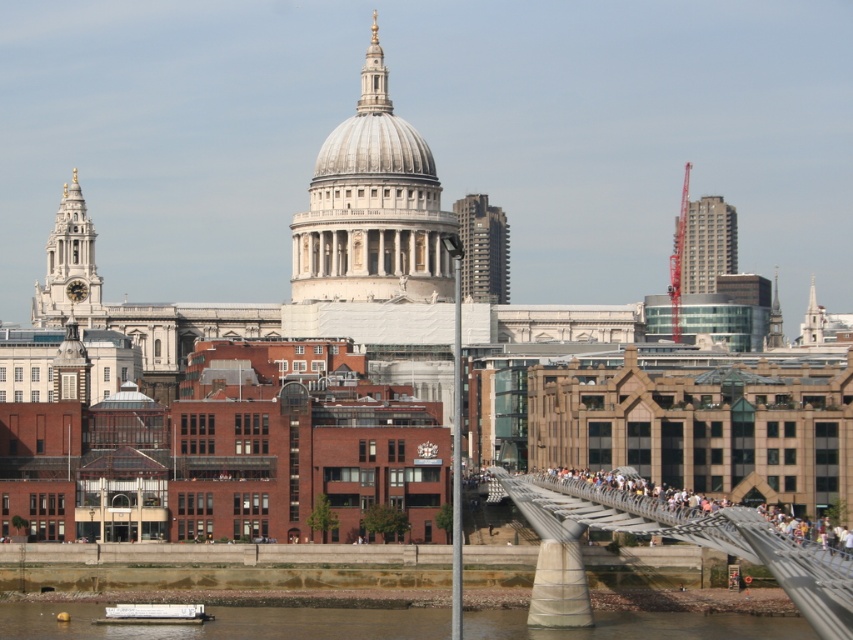
You are standing on the Millennium Bridge and looking towards St. Paul Cathedral. There are two points marked on the bridge. One is at coordinate point (672, 611) and the other is at point (129, 616). Which point is closer to you?

Point (129, 616) is closer to you because it is closer to the camera than point (672, 611).

You are standing at the point labeled as point (693, 538). What is the nearest object to you in this scene?

The nearest object to you is the metallic gray bridge at lower right because the point (693, 538) indicates its location.